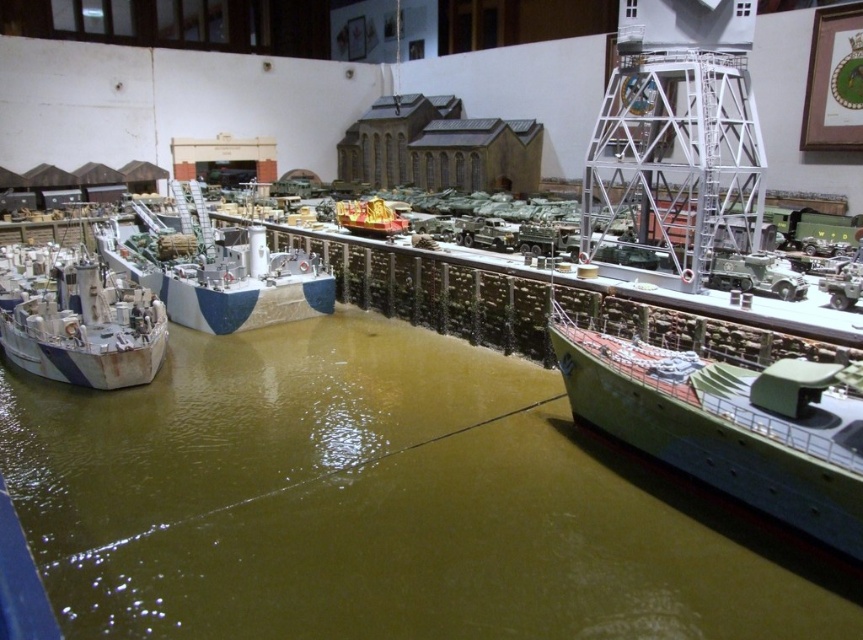
Question: Estimate the real-world distances between objects in this image. Which object is farther from the green matte ship at center?

Choices:
 (A) rusty metal ship at left
 (B) blue painted wood boat at center
 (C) green matte water at center

Answer: (A)

Question: Estimate the real-world distances between objects in this image. Which object is farther from the blue painted wood boat at center?

Choices:
 (A) green matte water at center
 (B) green matte ship at center
 (C) rusty metal ship at left

Answer: (B)

Question: Does green matte water at center appear on the left side of rusty metal ship at left?

Choices:
 (A) yes
 (B) no

Answer: (B)

Question: Is green matte ship at center above rusty metal ship at left?

Choices:
 (A) no
 (B) yes

Answer: (A)

Question: Which of the following is the farthest from the observer?

Choices:
 (A) rusty metal ship at left
 (B) blue painted wood boat at center
 (C) green matte water at center
 (D) green matte ship at center

Answer: (B)

Question: Does blue painted wood boat at center lie in front of rusty metal ship at left?

Choices:
 (A) no
 (B) yes

Answer: (A)